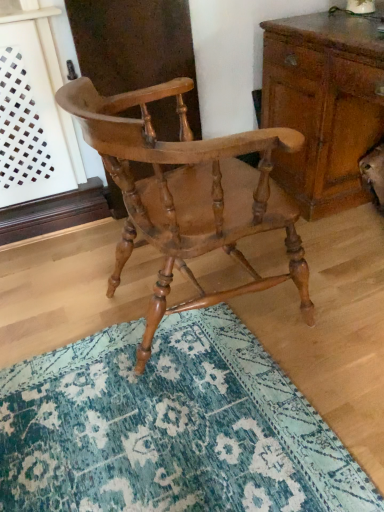
Describe the element at coordinates (169, 426) in the screenshot. This screenshot has height=512, width=384. I see `teal textured rug at center` at that location.

I want to click on teal textured rug at center, so click(x=169, y=426).

Locate an element on the screen. Image resolution: width=384 pixels, height=512 pixels. wooden chest of drawers at right is located at coordinates (x=323, y=105).

From a real-world perspective, between light brown wood chair at center and teal textured rug at center, who is vertically lower?

From a 3D spatial view, teal textured rug at center is below.

Locate an element on the screen. The height and width of the screenshot is (512, 384). doormat below the light brown wood chair at center (from the image's perspective) is located at coordinates (169, 426).

Between point (221, 223) and point (19, 507), which one is positioned in front?

Point (19, 507)

From the image's perspective, is wooden chest of drawers at right under light brown wood chair at center?

No, from the image's perspective, wooden chest of drawers at right is not beneath light brown wood chair at center.

Based on their sizes in the image, would you say wooden chest of drawers at right is bigger or smaller than light brown wood chair at center?

In the image, wooden chest of drawers at right appears to be larger than light brown wood chair at center.

Is wooden chest of drawers at right positioned with its back to light brown wood chair at center?

No, light brown wood chair at center is not at the back of wooden chest of drawers at right.

Considering the positions of point (280, 25) and point (235, 153), is point (280, 25) closer or farther from the camera than point (235, 153)?

Point (280, 25) appears to be farther away from the viewer than point (235, 153).

This screenshot has width=384, height=512. What are the coordinates of `chair to the left of wooden chest of drawers at right` in the screenshot? It's located at (188, 194).

Considering the sizes of objects light brown wood chair at center and wooden chest of drawers at right in the image provided, who is shorter, light brown wood chair at center or wooden chest of drawers at right?

wooden chest of drawers at right.

From the image's perspective, is light brown wood chair at center located above or below wooden chest of drawers at right?

Based on their image positions, light brown wood chair at center is located beneath wooden chest of drawers at right.

Is wooden chest of drawers at right surrounding teal textured rug at center?

Definitely not — teal textured rug at center is not inside wooden chest of drawers at right.

From the image's perspective, who appears lower, wooden chest of drawers at right or teal textured rug at center?

From the image's view, teal textured rug at center is below.

Is wooden chest of drawers at right positioned before teal textured rug at center?

No, it is behind teal textured rug at center.

Which point is more distant from viewer, (301, 191) or (134, 440)?

Positioned behind is point (301, 191).

Consider the image. Considering the positions of objects teal textured rug at center and light brown wood chair at center in the image provided, who is more to the right, teal textured rug at center or light brown wood chair at center?

Positioned to the right is light brown wood chair at center.

Considering the sizes of teal textured rug at center and light brown wood chair at center in the image, is teal textured rug at center taller or shorter than light brown wood chair at center?

Result: In the image, teal textured rug at center appears to be shorter than light brown wood chair at center.

Is teal textured rug at center aimed at light brown wood chair at center?

No, teal textured rug at center is not aimed at light brown wood chair at center.

From the image's perspective, who appears lower, teal textured rug at center or wooden chest of drawers at right?

From the image's view, teal textured rug at center is below.

Which object is wider, teal textured rug at center or wooden chest of drawers at right?

Wider between the two is wooden chest of drawers at right.

Is teal textured rug at center positioned with its back to wooden chest of drawers at right?

That's not correct — teal textured rug at center is not looking away from wooden chest of drawers at right.

The width and height of the screenshot is (384, 512). Identify the location of chair above the teal textured rug at center (from the image's perspective). (188, 194).

Identify the location of chair located below the wooden chest of drawers at right (from the image's perspective). (188, 194).

Based on their spatial positions, is teal textured rug at center or wooden chest of drawers at right further from light brown wood chair at center?

wooden chest of drawers at right is further to light brown wood chair at center.

Based on the photo, from the image, which object appears to be nearer to teal textured rug at center, light brown wood chair at center or wooden chest of drawers at right?

light brown wood chair at center lies closer to teal textured rug at center than the other object.

Based on the photo, which object lies further to the anchor point wooden chest of drawers at right, light brown wood chair at center or teal textured rug at center?

teal textured rug at center is further to wooden chest of drawers at right.

From the image, which object appears to be nearer to teal textured rug at center, wooden chest of drawers at right or light brown wood chair at center?

Based on the image, light brown wood chair at center appears to be nearer to teal textured rug at center.

Based on their spatial positions, is teal textured rug at center or light brown wood chair at center closer to wooden chest of drawers at right?

light brown wood chair at center is positioned closer to the anchor wooden chest of drawers at right.

Considering their positions, is wooden chest of drawers at right positioned closer to light brown wood chair at center than teal textured rug at center?

Based on the image, teal textured rug at center appears to be nearer to light brown wood chair at center.

I want to click on chair between teal textured rug at center and wooden chest of drawers at right from left to right, so click(x=188, y=194).